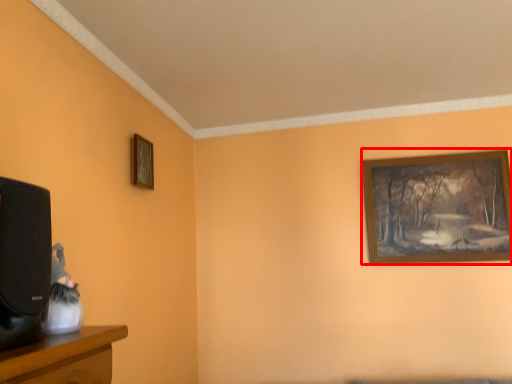
Question: Considering the relative positions of picture frame (annotated by the red box) and picture frame in the image provided, where is picture frame (annotated by the red box) located with respect to the staircase?

Choices:
 (A) right
 (B) left

Answer: (A)